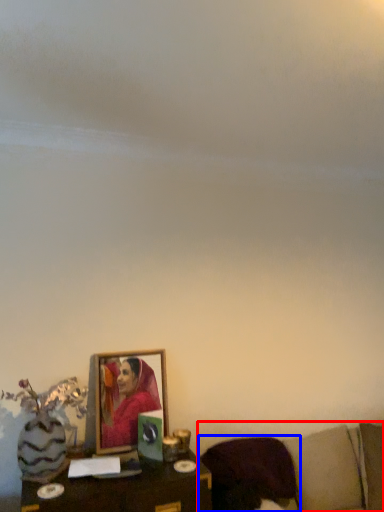
Question: Which of the following is the closest to the observer, furniture (highlighted by a red box) or pillow (highlighted by a blue box)?

Choices:
 (A) furniture
 (B) pillow

Answer: (A)